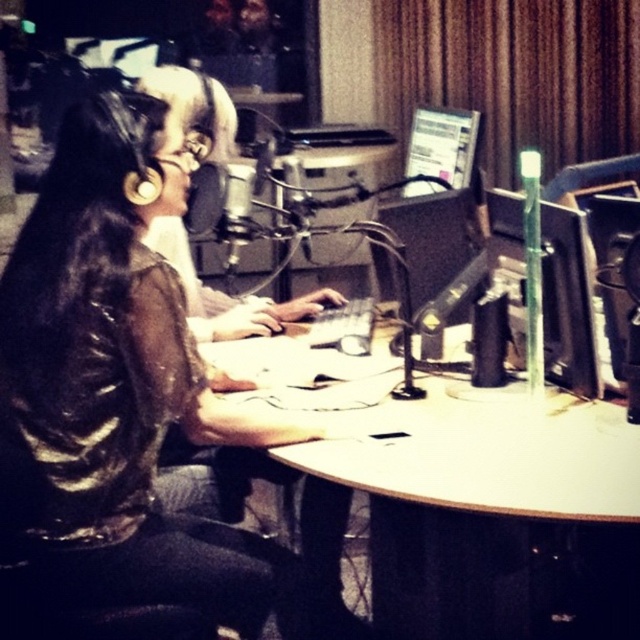
What are the coordinates of `matte black shirt at center` in the screenshot? It's located at (108, 384).

Which is in front, point (264, 600) or point (432, 464)?

Positioned in front is point (432, 464).

The width and height of the screenshot is (640, 640). What are the coordinates of `matte black shirt at center` in the screenshot? It's located at (108, 384).